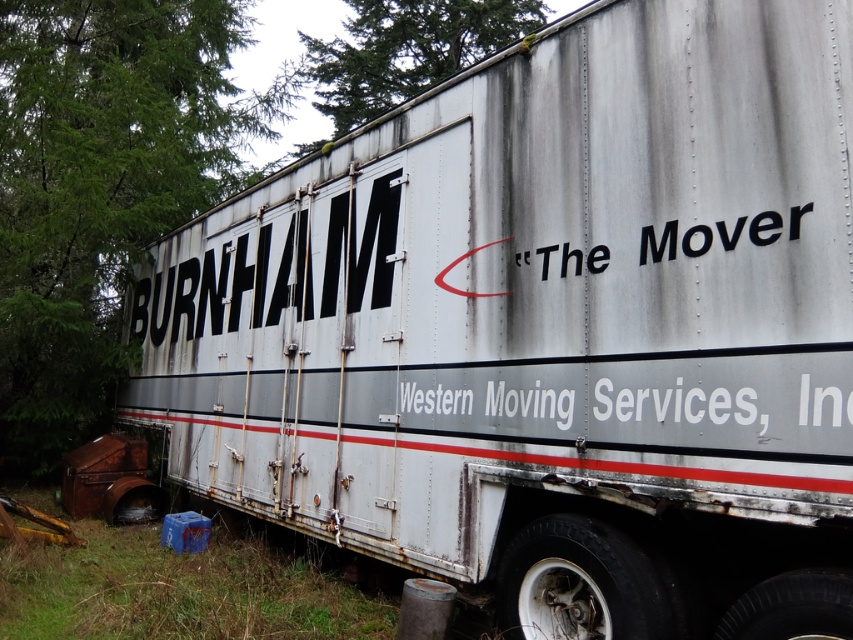
This screenshot has width=853, height=640. I want to click on green mossy tree at upper center, so click(x=405, y=51).

Which is in front, point (386, 52) or point (762, 243)?

Positioned in front is point (762, 243).

Where is `green mossy tree at upper center`? The height and width of the screenshot is (640, 853). green mossy tree at upper center is located at coordinates (x=405, y=51).

Describe the element at coordinates (405, 51) in the screenshot. The image size is (853, 640). I see `green mossy tree at upper center` at that location.

This screenshot has height=640, width=853. What are the coordinates of `green mossy tree at upper center` in the screenshot? It's located at (405, 51).

Which is more to the left, white matte text at center or black matte text at center?

white matte text at center is more to the left.

What do you see at coordinates (527, 403) in the screenshot?
I see `white matte text at center` at bounding box center [527, 403].

Where is `white matte text at center`? This screenshot has width=853, height=640. white matte text at center is located at coordinates (527, 403).